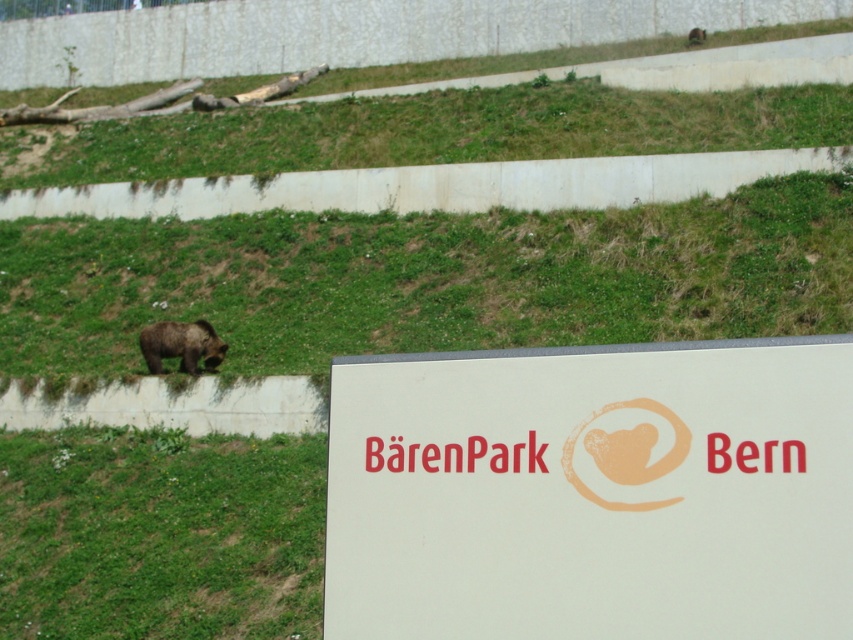
Which is below, white matte sign at center or brown furry bear at lower left?

white matte sign at center is below.

Between point (714, 356) and point (160, 340), which one is positioned behind?

Point (160, 340)

Image resolution: width=853 pixels, height=640 pixels. I want to click on white matte sign at center, so click(592, 492).